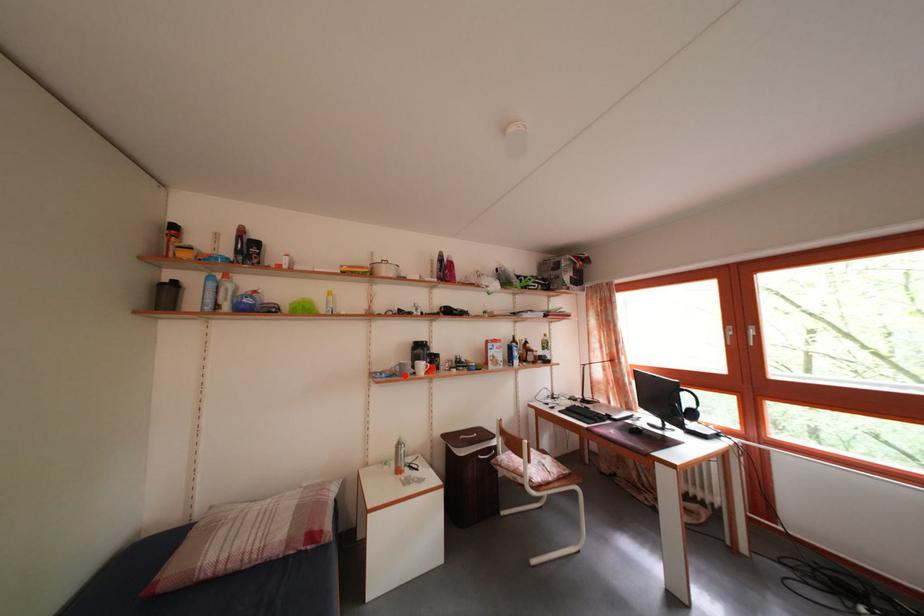
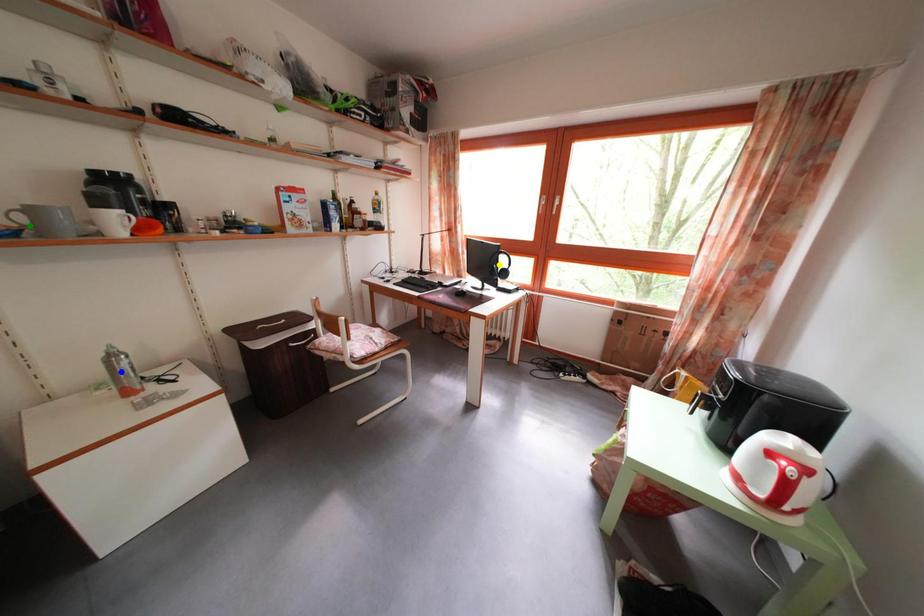
Question: I am providing you with two images of the same scene from different viewpoints. A red point is marked on the first image. You are given multiple points on the second image. Which spot in image 2 lines up with the point in image 1?

Choices:
 (A) green point
 (B) yellow point
 (C) blue point

Answer: (A)